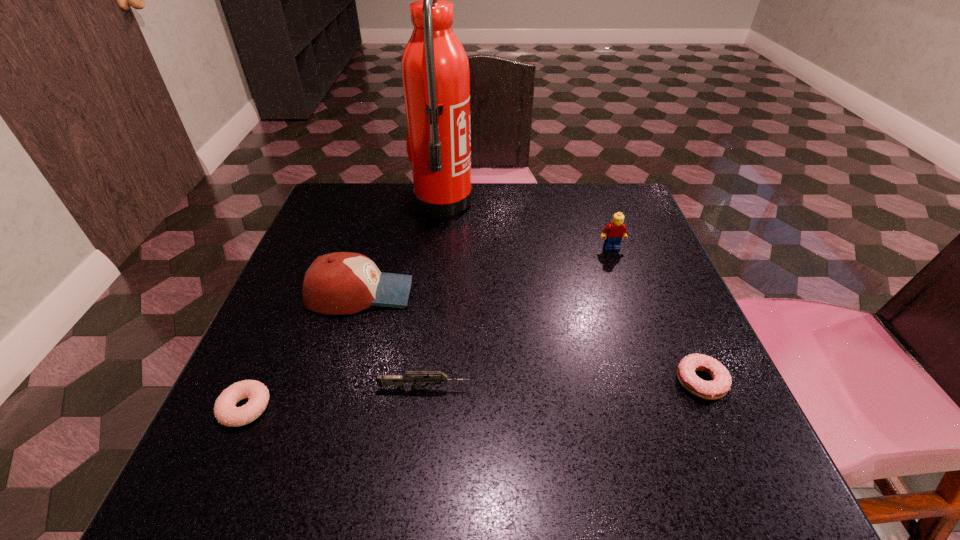
Locate an element on the screen. Image resolution: width=960 pixels, height=540 pixels. unoccupied position between the tallest object and the third farthest object is located at coordinates (401, 248).

Where is `object that is the fifth closest to the Lego`? The width and height of the screenshot is (960, 540). object that is the fifth closest to the Lego is located at coordinates pos(225,411).

This screenshot has height=540, width=960. Identify the location of object that stands as the second closest to the tallest object. (613, 233).

This screenshot has width=960, height=540. I want to click on blank area in the image that satisfies the following two spatial constraints: 1. on the front-facing side of the baseball cap; 2. on the left side of the right doughnut, so click(335, 382).

Image resolution: width=960 pixels, height=540 pixels. In order to click on free region that satisfies the following two spatial constraints: 1. on the label side of the tallest object; 2. on the right side of the right doughnut in this screenshot , I will do `click(422, 382)`.